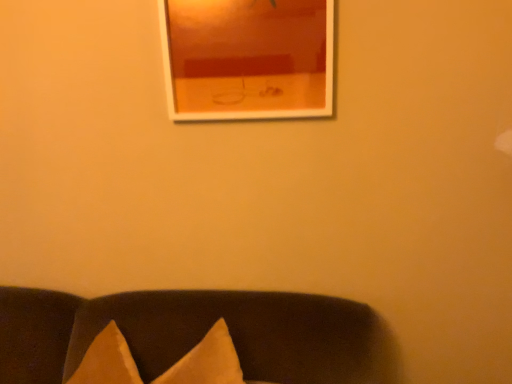
Identify the location of matte fabric cushions at lower center. This screenshot has width=512, height=384. (191, 333).

This screenshot has width=512, height=384. What do you see at coordinates (191, 333) in the screenshot?
I see `matte fabric cushions at lower center` at bounding box center [191, 333].

Describe the element at coordinates (247, 58) in the screenshot. I see `white glossy picture frame at upper center` at that location.

What is the approximate width of white glossy picture frame at upper center?

It is 3.42 inches.

Locate an element on the screen. white glossy picture frame at upper center is located at coordinates (247, 58).

Where is `matte fabric cushions at lower center`? Image resolution: width=512 pixels, height=384 pixels. matte fabric cushions at lower center is located at coordinates (191, 333).

Which is more to the right, white glossy picture frame at upper center or matte fabric cushions at lower center?

white glossy picture frame at upper center.

Is white glossy picture frame at upper center in front of or behind matte fabric cushions at lower center in the image?

In the image, white glossy picture frame at upper center appears behind matte fabric cushions at lower center.

Is point (214, 43) behind point (354, 326)?

No.

From the image's perspective, is white glossy picture frame at upper center on matte fabric cushions at lower center?

Yes.

From a real-world perspective, is white glossy picture frame at upper center physically above matte fabric cushions at lower center?

Yes, from a real-world perspective, white glossy picture frame at upper center is above matte fabric cushions at lower center.

Is white glossy picture frame at upper center wider or thinner than matte fabric cushions at lower center?

white glossy picture frame at upper center is thinner than matte fabric cushions at lower center.

Considering the sizes of white glossy picture frame at upper center and matte fabric cushions at lower center in the image, is white glossy picture frame at upper center taller or shorter than matte fabric cushions at lower center?

Clearly, white glossy picture frame at upper center is shorter compared to matte fabric cushions at lower center.

Which of these two, white glossy picture frame at upper center or matte fabric cushions at lower center, is smaller?

With smaller size is white glossy picture frame at upper center.

Is white glossy picture frame at upper center surrounding matte fabric cushions at lower center?

Actually, matte fabric cushions at lower center is outside white glossy picture frame at upper center.

Is white glossy picture frame at upper center beside matte fabric cushions at lower center?

No, white glossy picture frame at upper center is not beside matte fabric cushions at lower center.

Does white glossy picture frame at upper center turn towards matte fabric cushions at lower center?

No, white glossy picture frame at upper center does not turn towards matte fabric cushions at lower center.

Identify the location of picture frame above the matte fabric cushions at lower center (from a real-world perspective). The width and height of the screenshot is (512, 384). (247, 58).

Considering the relative positions of matte fabric cushions at lower center and white glossy picture frame at upper center in the image provided, is matte fabric cushions at lower center to the left of white glossy picture frame at upper center from the viewer's perspective?

Indeed, matte fabric cushions at lower center is positioned on the left side of white glossy picture frame at upper center.

Who is more distant, matte fabric cushions at lower center or white glossy picture frame at upper center?

white glossy picture frame at upper center is further away from the camera.

Which is closer, (x=362, y=330) or (x=218, y=109)?

Point (x=362, y=330) appears to be closer to the viewer than point (x=218, y=109).

From the image's perspective, is matte fabric cushions at lower center located above or below white glossy picture frame at upper center?

matte fabric cushions at lower center is below white glossy picture frame at upper center.

From a real-world perspective, is matte fabric cushions at lower center above or below white glossy picture frame at upper center?

matte fabric cushions at lower center is situated lower than white glossy picture frame at upper center in the real world.

Does matte fabric cushions at lower center have a greater width compared to white glossy picture frame at upper center?

Correct, the width of matte fabric cushions at lower center exceeds that of white glossy picture frame at upper center.

Which of these two, matte fabric cushions at lower center or white glossy picture frame at upper center, stands taller?

matte fabric cushions at lower center.

Can you confirm if matte fabric cushions at lower center is bigger than white glossy picture frame at upper center?

Indeed, matte fabric cushions at lower center has a larger size compared to white glossy picture frame at upper center.

Choose the correct answer: Is matte fabric cushions at lower center inside white glossy picture frame at upper center or outside it?

The correct answer is: outside.

Are matte fabric cushions at lower center and white glossy picture frame at upper center beside each other?

No, matte fabric cushions at lower center is not in contact with white glossy picture frame at upper center.

Is matte fabric cushions at lower center looking in the opposite direction of white glossy picture frame at upper center?

No.

This screenshot has width=512, height=384. I want to click on furniture in front of the white glossy picture frame at upper center, so click(191, 333).

Where is `furniture on the left of white glossy picture frame at upper center`? This screenshot has height=384, width=512. furniture on the left of white glossy picture frame at upper center is located at coordinates (191, 333).

Locate an element on the screen. This screenshot has height=384, width=512. furniture that appears below the white glossy picture frame at upper center (from the image's perspective) is located at coordinates (191, 333).